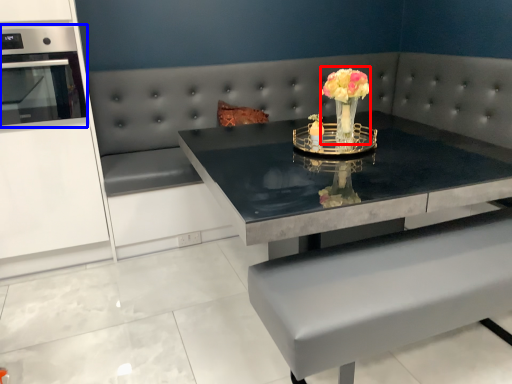
Question: Which object is further to the camera taking this photo, floral arrangement (highlighted by a red box) or appliance (highlighted by a blue box)?

Choices:
 (A) floral arrangement
 (B) appliance

Answer: (B)